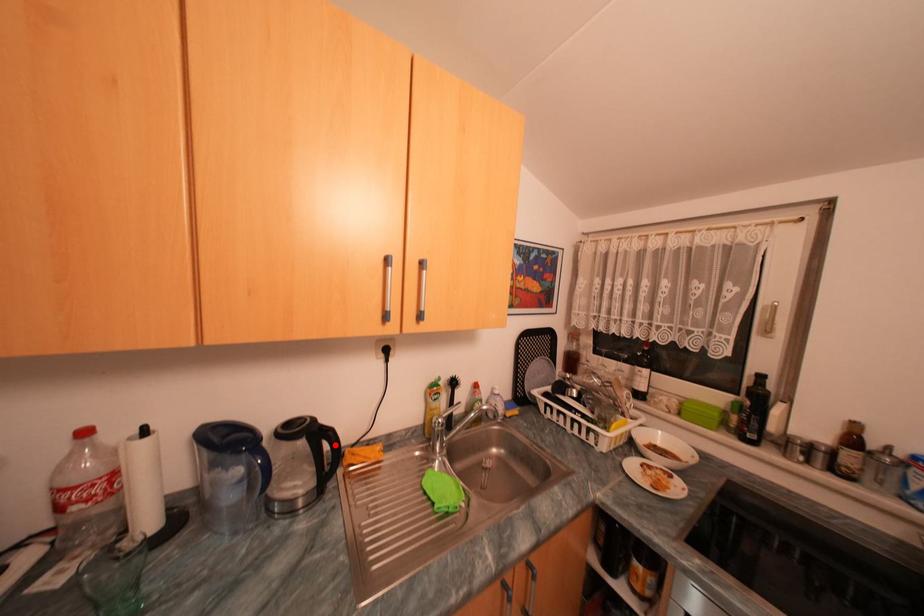
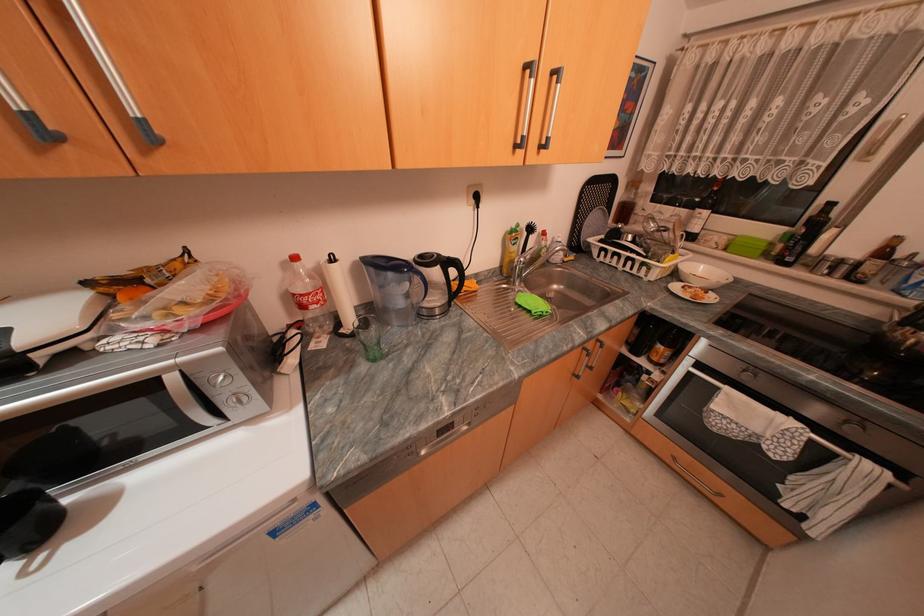
Find the pixel in the second image that matches the highlighted location in the first image.

(463, 270)